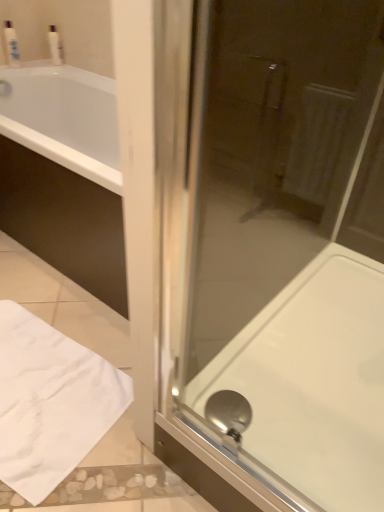
Question: Relative to white glossy bottle at upper left, the 2th toiletry positioned from the left, is white fabric towel at lower left in front or behind?

Choices:
 (A) front
 (B) behind

Answer: (A)

Question: Choose the correct answer: Is white fabric towel at lower left inside white glossy bottle at upper left, the 2th toiletry positioned from the left, or outside it?

Choices:
 (A) inside
 (B) outside

Answer: (B)

Question: Based on their relative distances, which object is nearer to the white fabric towel at lower left?

Choices:
 (A) white glossy bath at center
 (B) white plastic bottle at upper left, the first toiletry viewed from the left
 (C) white glossy bottle at upper left, the first toiletry viewed from the right
 (D) transparent glass shower door at center

Answer: (A)

Question: Which object is the closest to the transparent glass shower door at center?

Choices:
 (A) white plastic bottle at upper left, the first toiletry viewed from the left
 (B) white glossy bottle at upper left, the first toiletry viewed from the right
 (C) white fabric towel at lower left
 (D) white glossy bath at center

Answer: (D)